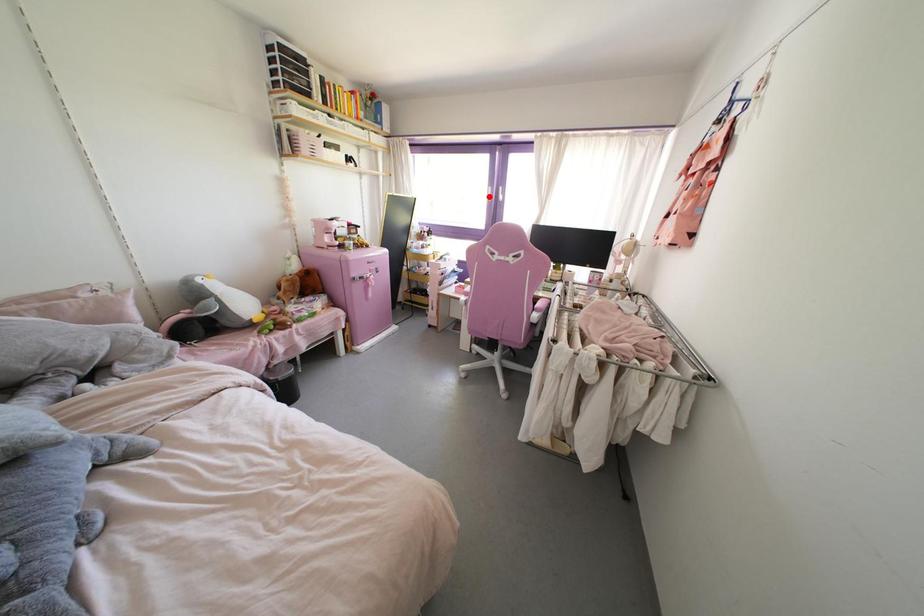
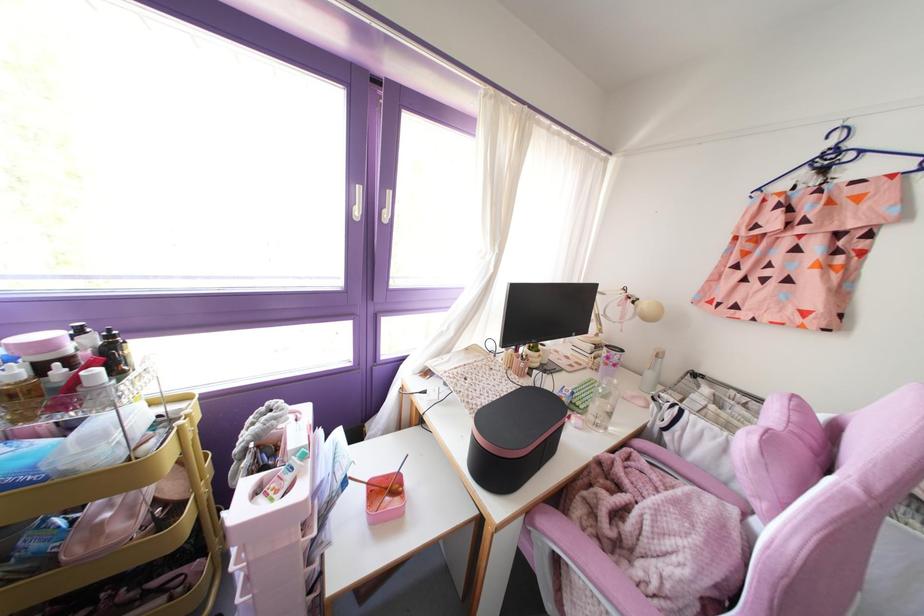
Question: I am providing you with two images of the same scene from different viewpoints. A red point is shown in image1. For the corresponding object point in image2, is it positioned nearer or farther from the camera?

Choices:
 (A) Nearer
 (B) Farther

Answer: (B)